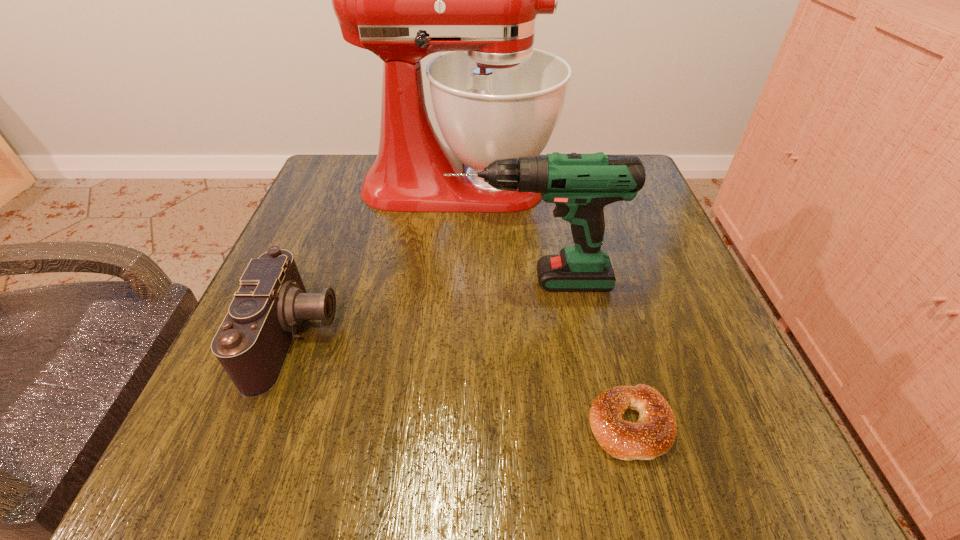
Identify the location of free space at the near edge of the desktop. Image resolution: width=960 pixels, height=540 pixels. (596, 448).

Find the location of a particular element. vacant area at the left edge is located at coordinates (360, 210).

Locate an element on the screen. vacant space at the right edge is located at coordinates (636, 353).

Where is `free space at the far left corner of the desktop`? free space at the far left corner of the desktop is located at coordinates (372, 159).

Image resolution: width=960 pixels, height=540 pixels. I want to click on vacant area at the near left corner, so click(x=201, y=426).

Locate an element on the screen. Image resolution: width=960 pixels, height=540 pixels. free spot between the camera and the drill is located at coordinates (414, 309).

This screenshot has width=960, height=540. I want to click on free spot between the farthest object and the second shortest object, so click(x=377, y=261).

Find the location of a particular element. The image size is (960, 540). vacant space that's between the farthest object and the second shortest object is located at coordinates (377, 261).

Where is `free space that is in between the second tallest object and the farthest object`? The width and height of the screenshot is (960, 540). free space that is in between the second tallest object and the farthest object is located at coordinates (495, 233).

Image resolution: width=960 pixels, height=540 pixels. I want to click on vacant space that's between the drill and the camera, so click(x=414, y=309).